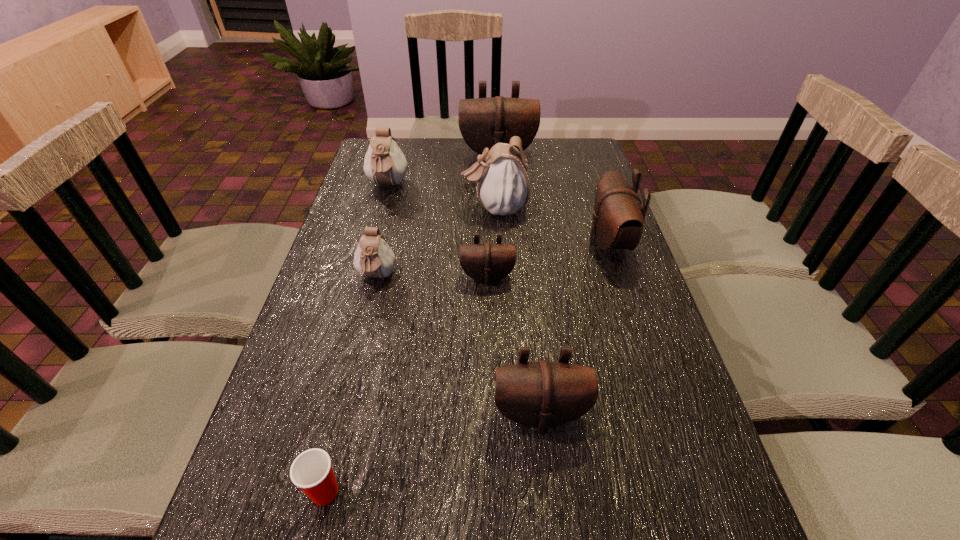
Where is `vacant point located between the smallest white pouch and the farthest brown pouch`? vacant point located between the smallest white pouch and the farthest brown pouch is located at coordinates (438, 216).

Where is `vacant point located between the nearest pouch and the smallest brown pouch`? vacant point located between the nearest pouch and the smallest brown pouch is located at coordinates (514, 346).

Where is `free space between the second biggest white pouch and the nearest pouch`? This screenshot has width=960, height=540. free space between the second biggest white pouch and the nearest pouch is located at coordinates (464, 300).

Where is `free point between the rightmost brown pouch and the smallest brown pouch`? This screenshot has height=540, width=960. free point between the rightmost brown pouch and the smallest brown pouch is located at coordinates (548, 260).

Where is `unoccupied position between the Dixie cup and the second biggest white pouch`? The width and height of the screenshot is (960, 540). unoccupied position between the Dixie cup and the second biggest white pouch is located at coordinates (356, 339).

The width and height of the screenshot is (960, 540). I want to click on vacant space that is in between the farthest pouch and the rightmost pouch, so click(x=553, y=199).

The image size is (960, 540). I want to click on free point between the red Dixie cup and the smallest brown pouch, so click(406, 384).

Find the location of a particular element. free space between the nearest white pouch and the nearest pouch is located at coordinates (458, 346).

This screenshot has width=960, height=540. Find the location of `empty space between the rightmost pouch and the nearest object`. empty space between the rightmost pouch and the nearest object is located at coordinates (467, 367).

Find the location of a particular element. the fourth closest object to the rightmost brown pouch is located at coordinates (542, 394).